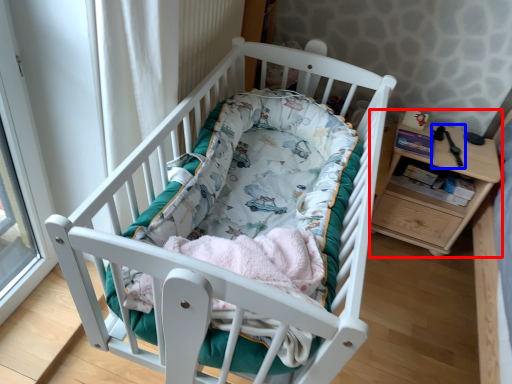
Question: Which of the following is the closest to the observer, changing table (highlighted by a red box) or equipment (highlighted by a blue box)?

Choices:
 (A) changing table
 (B) equipment

Answer: (A)